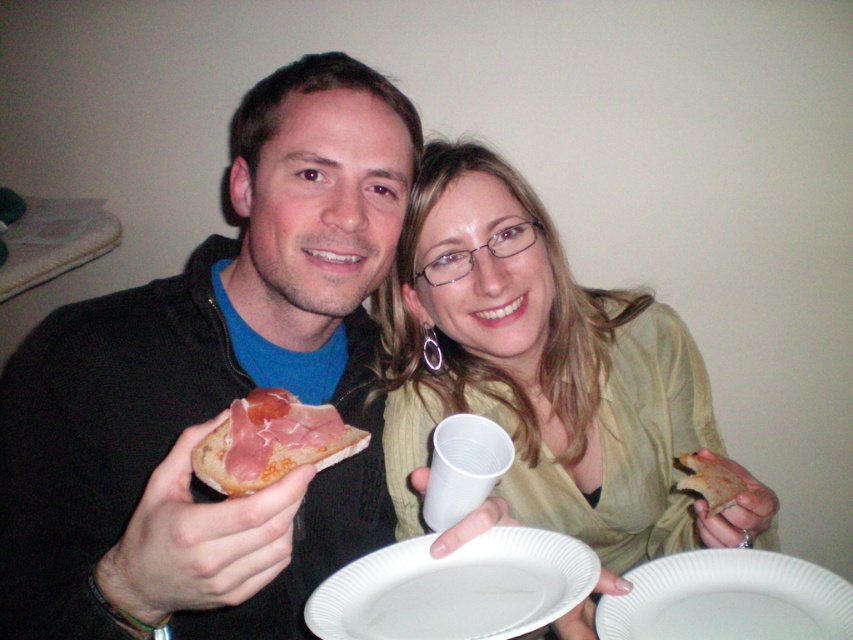
Question: Estimate the real-world distances between objects in this image. Which object is closer to the white paper plate at lower center?

Choices:
 (A) golden crispy pizza slice at right
 (B) prosciutto on bread at center

Answer: (A)

Question: Does white paper plate at center have a larger size compared to white paper plate at lower center?

Choices:
 (A) no
 (B) yes

Answer: (B)

Question: Considering the real-world distances, which object is farthest from the white paper plate at center?

Choices:
 (A) matte black jacket at center
 (B) prosciutto on bread at center
 (C) matte green blouse at center
 (D) golden crispy pizza slice at right

Answer: (C)

Question: Does matte green blouse at center have a greater width compared to prosciutto on bread at center?

Choices:
 (A) no
 (B) yes

Answer: (B)

Question: Does matte green blouse at center have a smaller size compared to white paper plate at center?

Choices:
 (A) yes
 (B) no

Answer: (B)

Question: Which point is closer to the camera?

Choices:
 (A) (421, 548)
 (B) (99, 328)
 (C) (321, 429)
 (D) (679, 518)

Answer: (C)